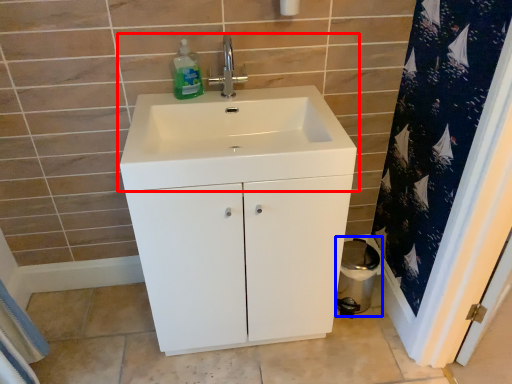
Question: Which of the following is the farthest to the observer, sink (highlighted by a red box) or toilet bowl (highlighted by a blue box)?

Choices:
 (A) sink
 (B) toilet bowl

Answer: (B)